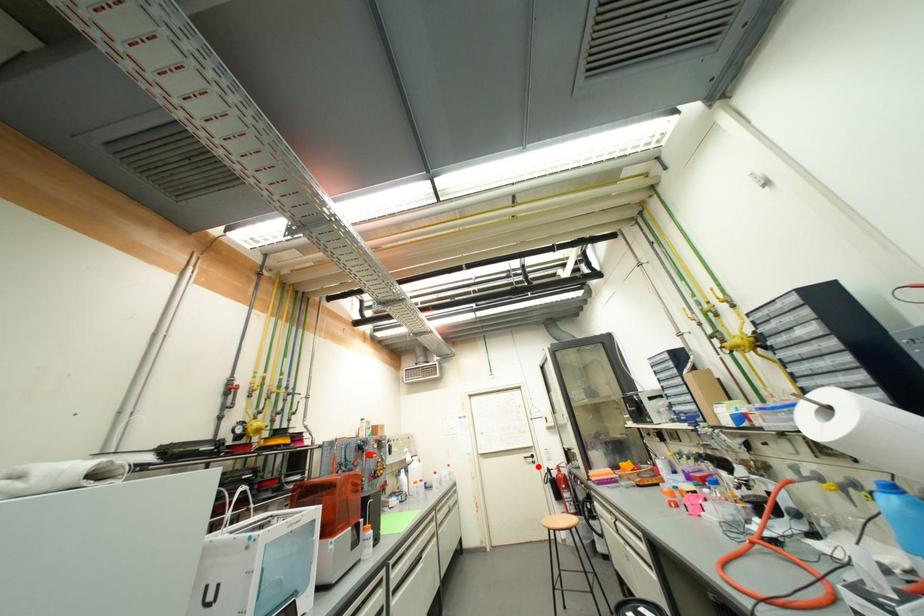
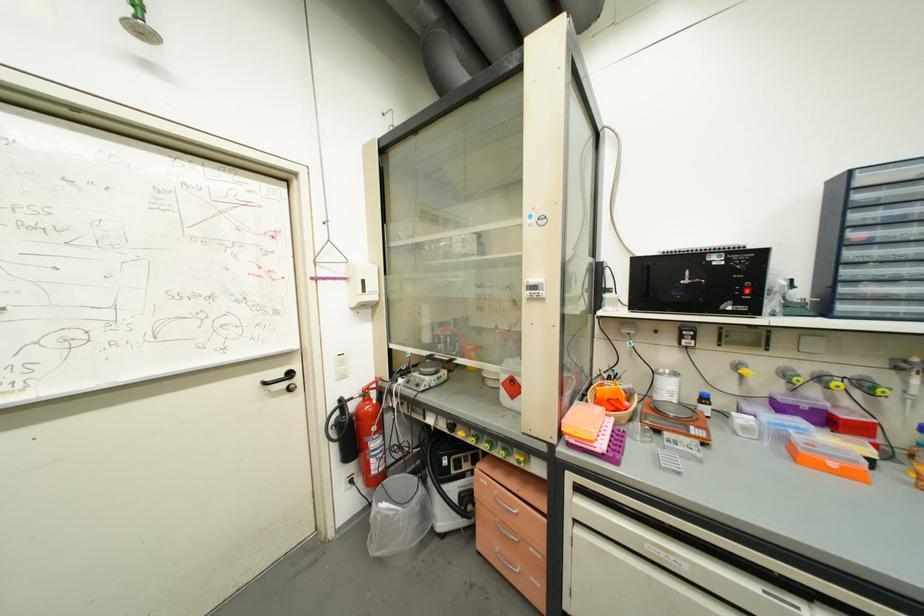
Question: I am providing you with two images of the same scene from different viewpoints. Image1 has a red point marked. In image2, the corresponding 3D location appears at what relative position? Reply with the corresponding letter.

Choices:
 (A) Closer
 (B) Farther

Answer: (A)